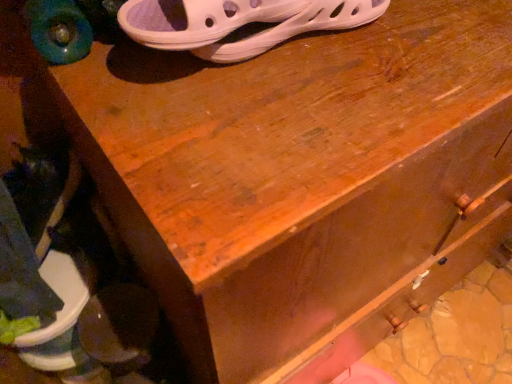
Locate an element on the screen. vacant space to the right of white mesh sandal at upper center, which is the 1th footwear from top to bottom is located at coordinates (426, 49).